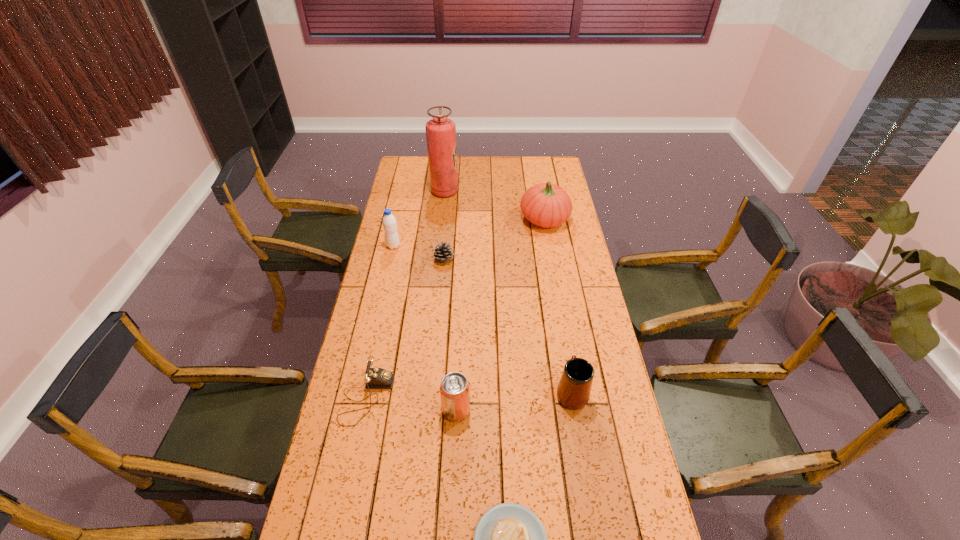
Identify the location of mug that is at the right edge. Image resolution: width=960 pixels, height=540 pixels. (573, 392).

Image resolution: width=960 pixels, height=540 pixels. I want to click on vacant space at the far edge, so click(467, 164).

Identify the location of free space at the left edge of the desktop. This screenshot has height=540, width=960. (383, 332).

In the image, there is a desktop. Where is `vacant space at the right edge`? This screenshot has height=540, width=960. vacant space at the right edge is located at coordinates (613, 379).

Locate an element on the screen. free point between the pinecone and the pumpkin is located at coordinates (494, 239).

This screenshot has width=960, height=540. What are the coordinates of `vacant area between the soda can and the farthest object` in the screenshot? It's located at (450, 301).

This screenshot has height=540, width=960. In order to click on free space between the pumpkin and the soda can in this screenshot , I will do `click(500, 314)`.

What are the coordinates of `empty space that is in between the soda can and the telephone` in the screenshot? It's located at (412, 403).

Locate an element on the screen. Image resolution: width=960 pixels, height=540 pixels. free point between the tallest object and the mug is located at coordinates (508, 292).

Locate an element on the screen. Image resolution: width=960 pixels, height=540 pixels. vacant area that lies between the farthest object and the second farthest object is located at coordinates (494, 205).